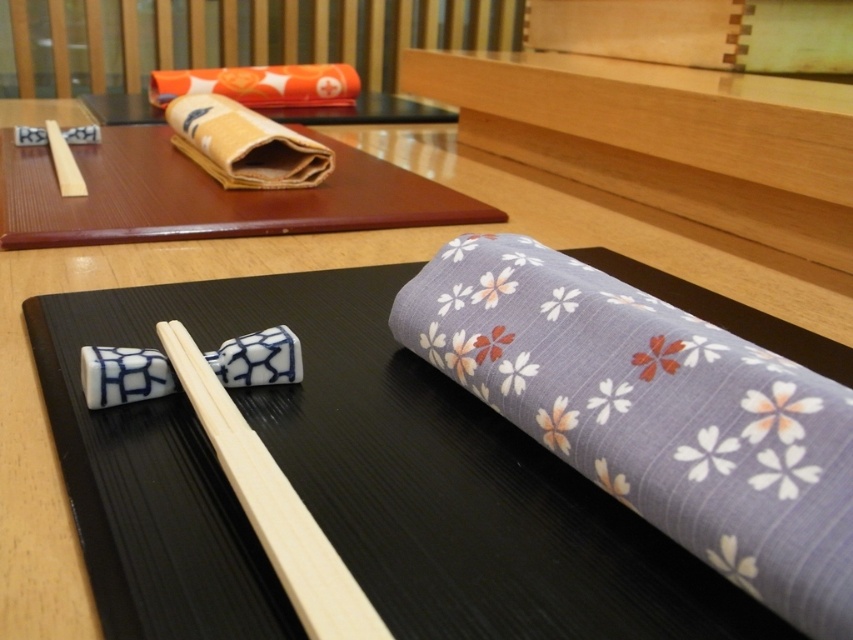
Question: Which point is farther to the camera?

Choices:
 (A) (70, 160)
 (B) (225, 157)
 (C) (438, 300)
 (D) (135, 394)

Answer: (A)

Question: Estimate the real-world distances between objects in this image. Which object is farther from the beige fabric at upper left?

Choices:
 (A) wooden tray at upper center
 (B) white glossy chopsticks at center

Answer: (B)

Question: Can you confirm if wooden tray at upper center is positioned below porcelain/patterned cube at center?

Choices:
 (A) no
 (B) yes

Answer: (A)

Question: Is wooden tray at upper center wider than beige fabric at upper left?

Choices:
 (A) no
 (B) yes

Answer: (B)

Question: Is wooden tray at upper center in front of porcelain/patterned cube at center?

Choices:
 (A) yes
 (B) no

Answer: (B)

Question: Which of the following is the closest to the observer?

Choices:
 (A) porcelain/patterned cube at center
 (B) wooden tray at upper center
 (C) porcelain/patterned chopstick rest at center
 (D) satin floral napkin at center

Answer: (D)